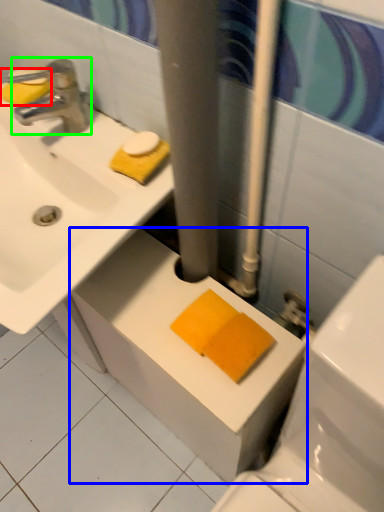
Question: Based on their relative distances, which object is farther from soap (highlighted by a red box)? Choose from counter top (highlighted by a blue box) and tap (highlighted by a green box).

Choices:
 (A) counter top
 (B) tap

Answer: (A)